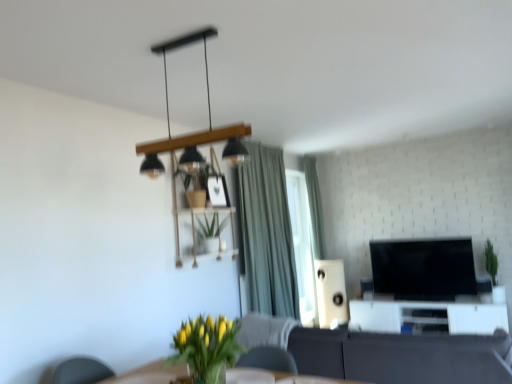
Question: Is black glossy tv at center right surrounded by green matte plant at right?

Choices:
 (A) no
 (B) yes

Answer: (A)

Question: Does green matte plant at right have a greater height compared to black glossy tv at center right?

Choices:
 (A) yes
 (B) no

Answer: (B)

Question: Can you confirm if green matte plant at right is thinner than black glossy tv at center right?

Choices:
 (A) yes
 (B) no

Answer: (B)

Question: Does green matte plant at right have a lesser height compared to black glossy tv at center right?

Choices:
 (A) yes
 (B) no

Answer: (A)

Question: Is green matte plant at right not close to black glossy tv at center right?

Choices:
 (A) no
 (B) yes

Answer: (A)

Question: Considering the relative positions of green matte plant at right and black glossy tv at center right in the image provided, is green matte plant at right in front of black glossy tv at center right?

Choices:
 (A) yes
 (B) no

Answer: (A)

Question: Are green matte plant at right and yellow-green leafy plant at lower center, the second houseplant from the top, located far from each other?

Choices:
 (A) no
 (B) yes

Answer: (B)

Question: Can you confirm if green matte plant at right is thinner than yellow-green leafy plant at lower center, which is the 2th houseplant from back to front?

Choices:
 (A) no
 (B) yes

Answer: (B)

Question: Is green matte plant at right to the left of yellow-green leafy plant at lower center, the second houseplant from the top, from the viewer's perspective?

Choices:
 (A) yes
 (B) no

Answer: (B)

Question: Is green matte plant at right outside of yellow-green leafy plant at lower center, which is the 2th houseplant from back to front?

Choices:
 (A) yes
 (B) no

Answer: (A)

Question: Considering the relative sizes of green matte plant at right and yellow-green leafy plant at lower center, the first houseplant positioned from the front, in the image provided, is green matte plant at right shorter than yellow-green leafy plant at lower center, the first houseplant positioned from the front,?

Choices:
 (A) no
 (B) yes

Answer: (A)

Question: Are green matte plant at right and yellow-green leafy plant at lower center, the first houseplant positioned from the front, making contact?

Choices:
 (A) no
 (B) yes

Answer: (A)

Question: From a real-world perspective, is white glossy entertainment center at lower right on green fabric curtain at upper center?

Choices:
 (A) no
 (B) yes

Answer: (A)